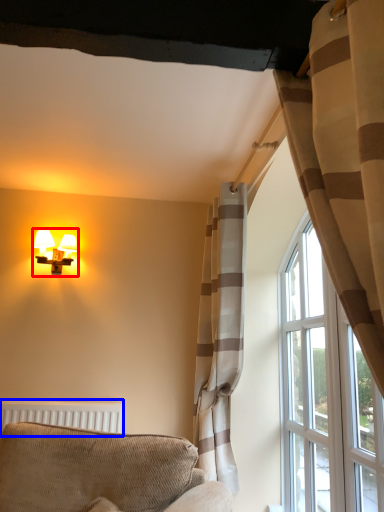
Question: Which object appears farthest to the camera in this image, lamp (highlighted by a red box) or radiator (highlighted by a blue box)?

Choices:
 (A) lamp
 (B) radiator

Answer: (A)